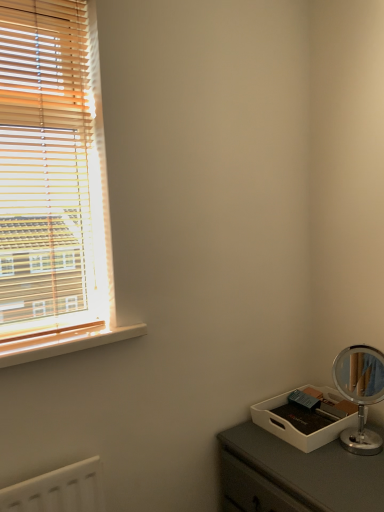
Question: Visually, is wooden at left positioned to the left or to the right of wooden blinds at left?

Choices:
 (A) right
 (B) left

Answer: (A)

Question: From the image's perspective, is wooden at left above or below wooden blinds at left?

Choices:
 (A) below
 (B) above

Answer: (A)

Question: Considering the positions of wooden at left and wooden blinds at left in the image, is wooden at left bigger or smaller than wooden blinds at left?

Choices:
 (A) small
 (B) big

Answer: (A)

Question: Is wooden blinds at left spatially inside wooden at left, or outside of it?

Choices:
 (A) inside
 (B) outside

Answer: (B)

Question: Is point (66, 199) positioned closer to the camera than point (41, 339)?

Choices:
 (A) farther
 (B) closer

Answer: (A)

Question: From a real-world perspective, is wooden blinds at left above or below wooden at left?

Choices:
 (A) below
 (B) above

Answer: (B)

Question: Is wooden blinds at left taller or shorter than wooden at left?

Choices:
 (A) tall
 (B) short

Answer: (A)